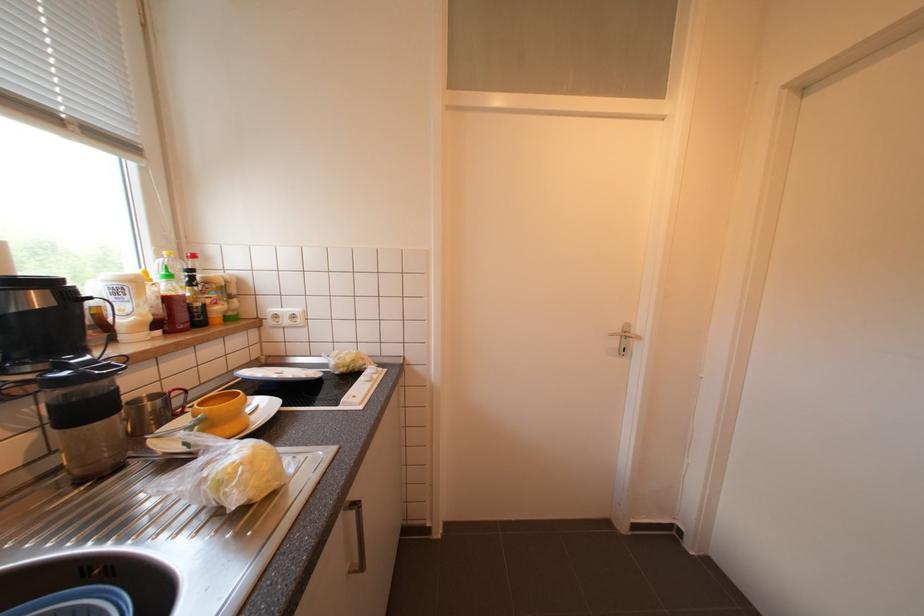
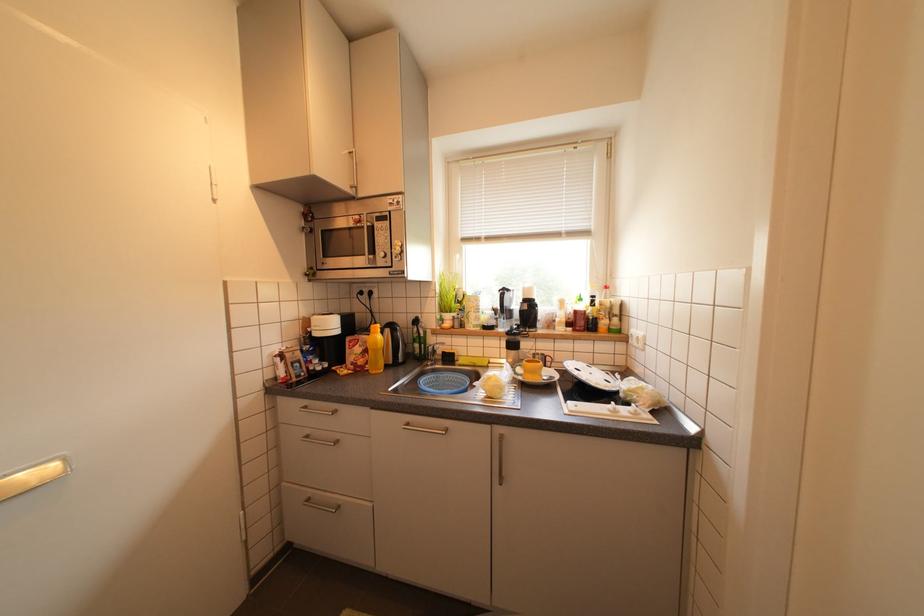
Question: The first image is from the beginning of the video and the second image is from the end. How did the camera likely rotate when shooting the video?

Choices:
 (A) Left
 (B) Right
 (C) Up
 (D) Down

Answer: (A)